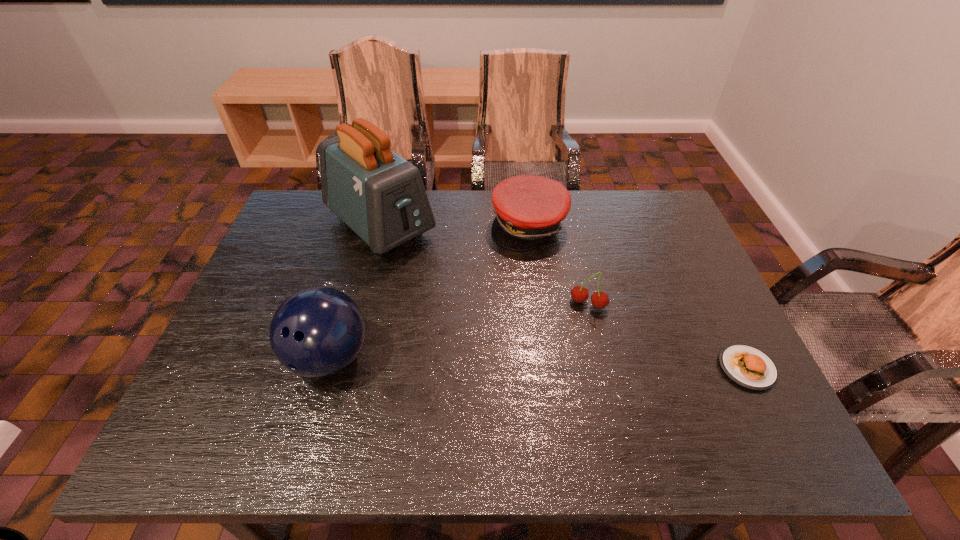
Where is `the fourth shortest object`? The image size is (960, 540). the fourth shortest object is located at coordinates (316, 332).

The width and height of the screenshot is (960, 540). Identify the location of the rightmost object. (746, 366).

Where is `the shortest object`? This screenshot has height=540, width=960. the shortest object is located at coordinates (746, 366).

Image resolution: width=960 pixels, height=540 pixels. What are the coordinates of `toaster` in the screenshot? It's located at (379, 195).

You are a GUI agent. You are given a task and a screenshot of the screen. Output one action in this format:
    pyautogui.click(x=<x>, y=<y>)
    Task: Click on the third nearest object
    The width and height of the screenshot is (960, 540).
    Given the screenshot: What is the action you would take?
    pyautogui.click(x=579, y=294)

Locate an element on the screen. This screenshot has width=960, height=540. cap is located at coordinates [x=529, y=209].

At what (x,y) coordinates should I click in order to perform the action: click on free spot located on the left of the rightmost object. Please return your answer as a coordinate pair (x, y). The width and height of the screenshot is (960, 540). Looking at the image, I should click on (666, 368).

At what (x,y) coordinates should I click in order to perform the action: click on vacant region located on the front-facing side of the tallest object. Please return your answer as a coordinate pair (x, y). The height and width of the screenshot is (540, 960). Looking at the image, I should click on (430, 271).

Identify the location of blank space located 0.140m on the front-facing side of the tallest object. (444, 282).

The image size is (960, 540). What are the coordinates of `vacant space located on the front-facing side of the tallest object` in the screenshot? It's located at (448, 286).